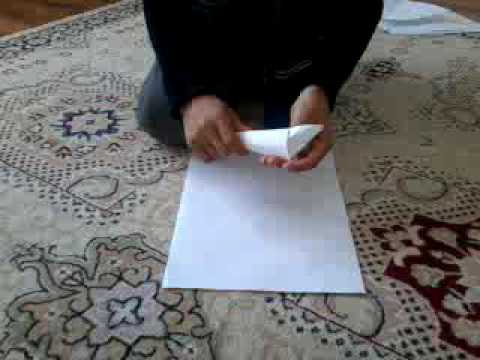
Identify the location of rug. (x=435, y=206).